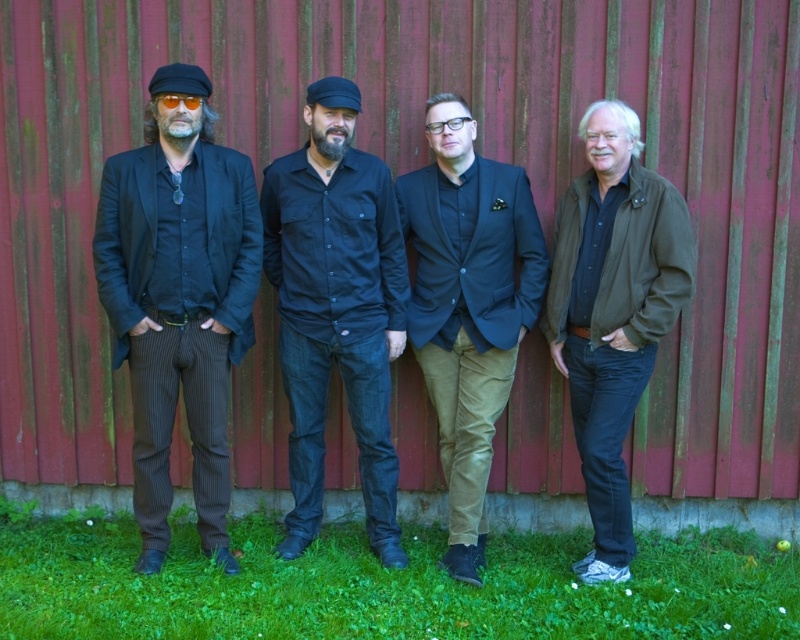
This screenshot has height=640, width=800. What are the coordinates of `black pinstripe suit at left` in the screenshot? It's located at (178, 298).

Is black pinstripe suit at left smaller than dark brown leather jacket at right?

No, black pinstripe suit at left is not smaller than dark brown leather jacket at right.

The image size is (800, 640). What do you see at coordinates (178, 298) in the screenshot?
I see `black pinstripe suit at left` at bounding box center [178, 298].

Locate an element on the screen. black pinstripe suit at left is located at coordinates (178, 298).

What are the coordinates of `black pinstripe suit at left` in the screenshot? It's located at (178, 298).

Between point (237, 289) and point (536, 273), which one is positioned behind?

Point (536, 273)

Does point (144, 403) come in front of point (409, 218)?

Yes, point (144, 403) is in front of point (409, 218).

I want to click on black pinstripe suit at left, so click(x=178, y=298).

Between point (366, 387) and point (488, 401), which one is positioned in front?

Point (488, 401) is more forward.

At what (x,y) coordinates should I click in order to perform the action: click on black denim jeans at center. Please return your answer as a coordinate pair (x, y). This screenshot has height=640, width=800. Looking at the image, I should click on [336, 308].